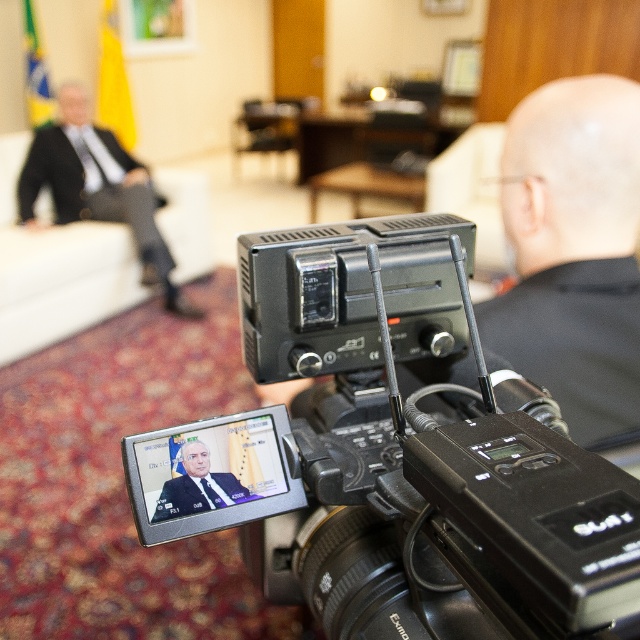
Based on the photo, is black plastic camera at center bigger than dark blue suit at center?

Indeed, black plastic camera at center has a larger size compared to dark blue suit at center.

Is point (468, 234) positioned after point (220, 499)?

Yes.

The width and height of the screenshot is (640, 640). Find the location of `black plastic camera at center`. black plastic camera at center is located at coordinates (401, 452).

Between black plastic camera at center and bald head at center, which one is positioned higher?

bald head at center is higher up.

Is black plastic camera at center thinner than bald head at center?

Incorrect, black plastic camera at center's width is not less than bald head at center's.

I want to click on black plastic camera at center, so click(x=401, y=452).

Where is `black plastic camera at center`? black plastic camera at center is located at coordinates (401, 452).

Can you confirm if bald head at center is bigger than dark blue suit at center?

Correct, bald head at center is larger in size than dark blue suit at center.

Does bald head at center have a lesser width compared to dark blue suit at center?

In fact, bald head at center might be wider than dark blue suit at center.

Where is `bald head at center`? The image size is (640, 640). bald head at center is located at coordinates (573, 252).